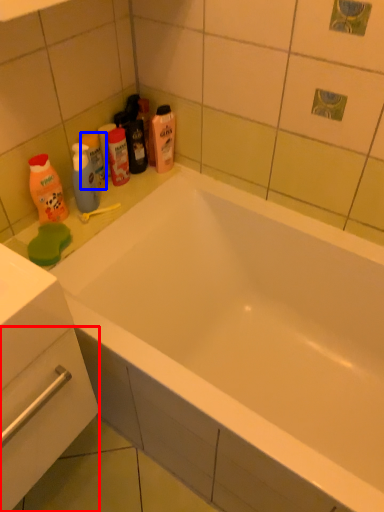
Question: Among these objects, which one is farthest to the camera, drawer (highlighted by a red box) or mouthwash (highlighted by a blue box)?

Choices:
 (A) drawer
 (B) mouthwash

Answer: (B)